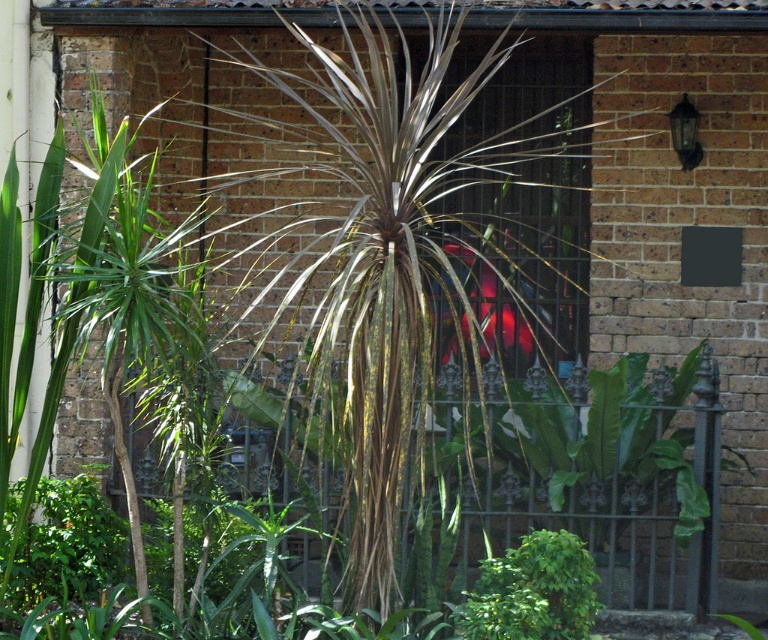
Question: Does silvery textured palm tree at center appear on the left side of green leafy bush at lower center?

Choices:
 (A) yes
 (B) no

Answer: (A)

Question: Is silvery textured palm tree at center bigger than green leafy bush at lower center?

Choices:
 (A) no
 (B) yes

Answer: (B)

Question: Can you confirm if silvery textured palm tree at center is thinner than green leafy bush at lower center?

Choices:
 (A) no
 (B) yes

Answer: (A)

Question: Which object is closer to the camera taking this photo?

Choices:
 (A) green leafy bush at lower center
 (B) silvery textured palm tree at center

Answer: (A)

Question: Which object appears closest to the camera in this image?

Choices:
 (A) silvery textured palm tree at center
 (B) green leafy bush at lower center

Answer: (B)